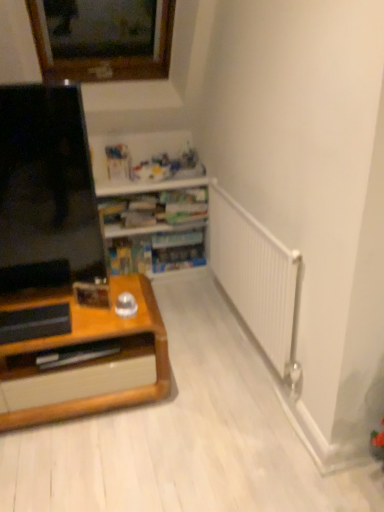
What do you see at coordinates (46, 190) in the screenshot? I see `black glossy screen at left` at bounding box center [46, 190].

Find the location of a particular element. black glossy screen at left is located at coordinates (46, 190).

Locate an element on the screen. The width and height of the screenshot is (384, 512). wooden bookshelf at center is located at coordinates (151, 202).

Image resolution: width=384 pixels, height=512 pixels. What do you see at coordinates (151, 202) in the screenshot? I see `wooden bookshelf at center` at bounding box center [151, 202].

The width and height of the screenshot is (384, 512). Identify the location of black glossy screen at left. (46, 190).

Between wooden bookshelf at center and black glossy screen at left, which one appears on the right side from the viewer's perspective?

Positioned to the right is wooden bookshelf at center.

Is the position of wooden bookshelf at center less distant than that of black glossy screen at left?

No, it is behind black glossy screen at left.

Between point (200, 194) and point (5, 243), which one is positioned in front?

The point (5, 243) is more forward.

From the image's perspective, would you say wooden bookshelf at center is shown under black glossy screen at left?

Correct, wooden bookshelf at center appears lower than black glossy screen at left in the image.

From a real-world perspective, is wooden bookshelf at center positioned above or below black glossy screen at left?

From a real-world perspective, wooden bookshelf at center is physically below black glossy screen at left.

Does wooden bookshelf at center have a lesser width compared to black glossy screen at left?

In fact, wooden bookshelf at center might be wider than black glossy screen at left.

Does wooden bookshelf at center have a greater height compared to black glossy screen at left?

In fact, wooden bookshelf at center may be shorter than black glossy screen at left.

Who is bigger, wooden bookshelf at center or black glossy screen at left?

wooden bookshelf at center.

Is wooden bookshelf at center spatially inside black glossy screen at left, or outside of it?

wooden bookshelf at center exists outside the volume of black glossy screen at left.

Is wooden bookshelf at center next to black glossy screen at left?

They are not placed beside each other.

Based on the photo, could you tell me if wooden bookshelf at center is turned towards black glossy screen at left?

Yes, wooden bookshelf at center is turned towards black glossy screen at left.

Based on the photo, can you tell me how much wooden bookshelf at center and black glossy screen at left differ in facing direction?

0.306 degrees.

How much distance is there between wooden bookshelf at center and black glossy screen at left?

wooden bookshelf at center is 32.06 inches from black glossy screen at left.

Locate an element on the screen. The image size is (384, 512). shelf behind the black glossy screen at left is located at coordinates (151, 202).

Is black glossy screen at left at the left side of wooden bookshelf at center?

Indeed, black glossy screen at left is positioned on the left side of wooden bookshelf at center.

Consider the image. Is black glossy screen at left in front of or behind wooden bookshelf at center in the image?

Visually, black glossy screen at left is located in front of wooden bookshelf at center.

Considering the points (27, 241) and (112, 252), which point is behind, point (27, 241) or point (112, 252)?

The point (112, 252) is farther from the camera.

From the image's perspective, between black glossy screen at left and wooden bookshelf at center, who is located below?

From the image's view, wooden bookshelf at center is below.

From a real-world perspective, who is located lower, black glossy screen at left or wooden bookshelf at center?

wooden bookshelf at center is physically lower.

Which of these two, black glossy screen at left or wooden bookshelf at center, is thinner?

black glossy screen at left.

Considering the sizes of black glossy screen at left and wooden bookshelf at center in the image, is black glossy screen at left taller or shorter than wooden bookshelf at center?

In the image, black glossy screen at left appears to be taller than wooden bookshelf at center.

Can you confirm if black glossy screen at left is smaller than wooden bookshelf at center?

Indeed, black glossy screen at left has a smaller size compared to wooden bookshelf at center.

Is wooden bookshelf at center located within black glossy screen at left?

Actually, wooden bookshelf at center is outside black glossy screen at left.

Are black glossy screen at left and wooden bookshelf at center beside each other?

No.

Does black glossy screen at left turn towards wooden bookshelf at center?

No, black glossy screen at left is not aimed at wooden bookshelf at center.

How far apart are black glossy screen at left and wooden bookshelf at center?

81.44 centimeters.

Image resolution: width=384 pixels, height=512 pixels. I want to click on screen located above the wooden bookshelf at center (from a real-world perspective), so click(x=46, y=190).

Locate an element on the screen. shelf on the right of black glossy screen at left is located at coordinates (151, 202).

The width and height of the screenshot is (384, 512). Identify the location of screen lying above the wooden bookshelf at center (from the image's perspective). (46, 190).